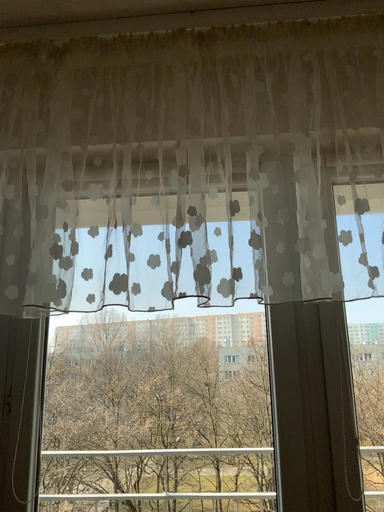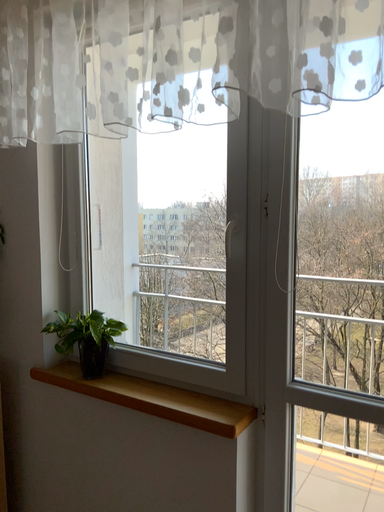
Question: How did the camera likely rotate when shooting the video?

Choices:
 (A) rotated downward
 (B) rotated upward

Answer: (A)